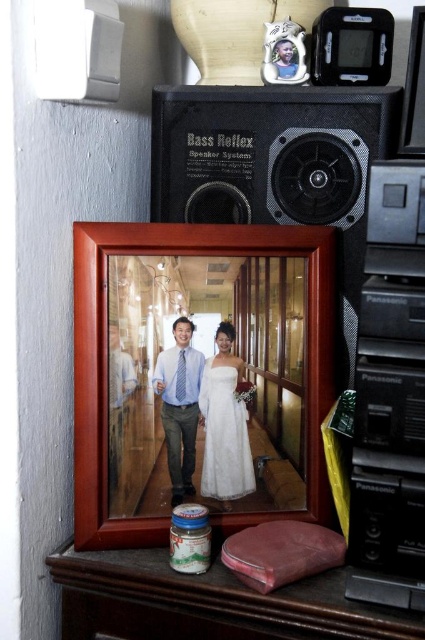
You are organizing a small event and need to place a 6.5 inch wide decorative item between the brown leather wallet at lower center and the white lace dress at center. Will there be enough space?

The brown leather wallet at lower center and white lace dress at center are 6.60 inches apart from each other. Since the decorative item is 6.5 inches wide, there is enough space to place it between them.

You are positioning a new decorative item on the wooden surface where the framed photograph and the black matte speaker system at upper center are placed. If you want to place the new item to the left of the speaker system, where should you place it relative to the framed photograph?

The black matte speaker system at upper center is located at point 0.263 on the x and 0.652 on the y. Since the speaker is to the right of the framed photograph, placing the new item to the left of the speaker would position it between the framed photograph and the speaker system.

You are standing in front of the framed photograph and want to touch two specific points on the wooden surface. The first point is at coordinate point (67, 636) and the second point is at coordinate point (215, 424). Which point would require you to reach further away from your body?

Point (215, 424) would require reaching further away from your body because it is farther from the camera compared to point (67, 636), which is closer.